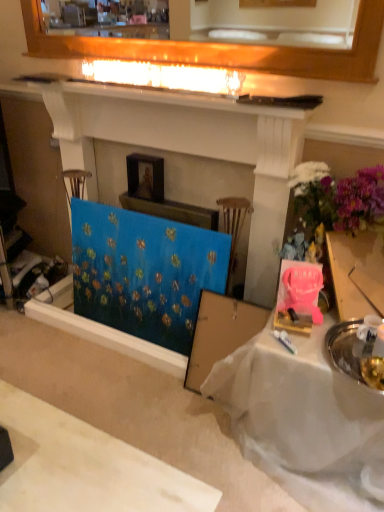
Question: From the image's perspective, is blue canvas at center over blue fabric painting at center?

Choices:
 (A) yes
 (B) no

Answer: (A)

Question: Is blue canvas at center to the right of blue fabric painting at center from the viewer's perspective?

Choices:
 (A) no
 (B) yes

Answer: (B)

Question: Does blue canvas at center lie in front of blue fabric painting at center?

Choices:
 (A) no
 (B) yes

Answer: (B)

Question: Is blue canvas at center positioned behind blue fabric painting at center?

Choices:
 (A) yes
 (B) no

Answer: (B)

Question: Is blue canvas at center in contact with blue fabric painting at center?

Choices:
 (A) no
 (B) yes

Answer: (A)

Question: Is blue fabric painting at center to the left or to the right of wooden picture frame at upper center in the image?

Choices:
 (A) right
 (B) left

Answer: (A)

Question: Is point (178, 308) positioned closer to the camera than point (142, 183)?

Choices:
 (A) closer
 (B) farther

Answer: (A)

Question: From the image's perspective, relative to wooden picture frame at upper center, is blue fabric painting at center above or below?

Choices:
 (A) below
 (B) above

Answer: (A)

Question: Is blue fabric painting at center inside or outside of wooden picture frame at upper center?

Choices:
 (A) inside
 (B) outside

Answer: (B)

Question: In the image, is white cloth-covered table at lower right positioned in front of or behind wooden picture frame at upper center?

Choices:
 (A) behind
 (B) front

Answer: (B)

Question: Is point (268, 328) closer or farther from the camera than point (155, 196)?

Choices:
 (A) farther
 (B) closer

Answer: (B)

Question: In terms of size, does white cloth-covered table at lower right appear bigger or smaller than wooden picture frame at upper center?

Choices:
 (A) small
 (B) big

Answer: (B)

Question: From a real-world perspective, is white cloth-covered table at lower right physically located above or below wooden picture frame at upper center?

Choices:
 (A) below
 (B) above

Answer: (A)

Question: In the image, is white cloth-covered table at lower right positioned in front of or behind blue fabric painting at center?

Choices:
 (A) behind
 (B) front

Answer: (B)

Question: Is point (316, 326) closer or farther from the camera than point (152, 284)?

Choices:
 (A) farther
 (B) closer

Answer: (B)